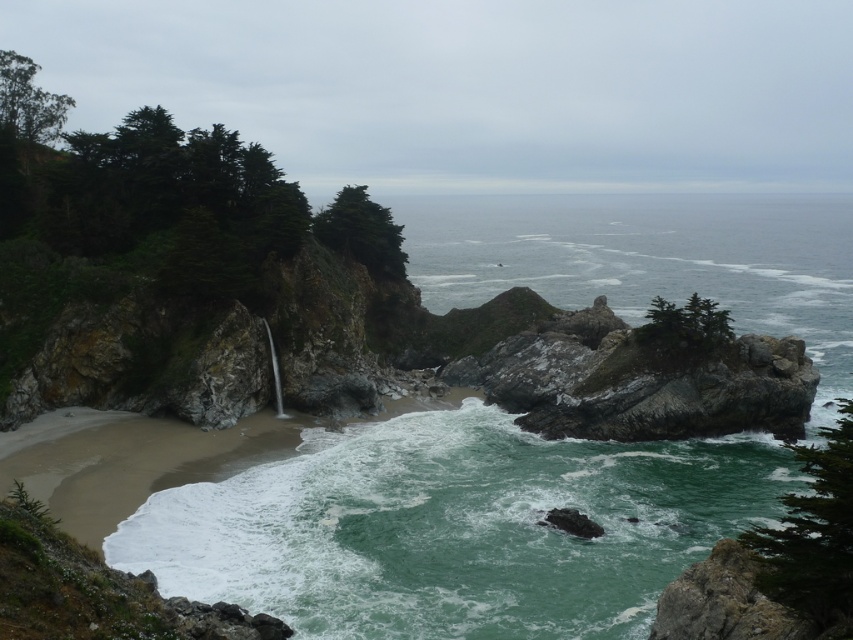
Question: Can you confirm if green rock at center is bigger than greenish-blue water at center?

Choices:
 (A) no
 (B) yes

Answer: (A)

Question: Can you confirm if green rock at center is positioned to the left of greenish-blue water at center?

Choices:
 (A) yes
 (B) no

Answer: (A)

Question: Which of the following is the closest to the observer?

Choices:
 (A) (538, 259)
 (B) (158, 493)

Answer: (B)

Question: Is green rock at center to the left of greenish-blue water at center from the viewer's perspective?

Choices:
 (A) no
 (B) yes

Answer: (B)

Question: Which object appears farthest from the camera in this image?

Choices:
 (A) greenish-blue water at center
 (B) green rock at center

Answer: (A)